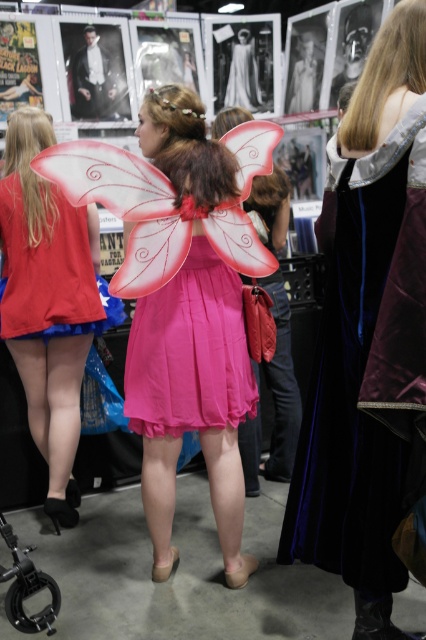
Question: Is pink satin dress at center smaller than matte red dress at center?

Choices:
 (A) no
 (B) yes

Answer: (A)

Question: Which point is closer to the camera?

Choices:
 (A) velvet black dress at center
 (B) matte red dress at center
 (C) pink fabric dress at center

Answer: (A)

Question: Which object is farther from the camera taking this photo?

Choices:
 (A) velvet black dress at center
 (B) black plastic baby carriage at lower left
 (C) pink fabric dress at center
 (D) matte pink fabric dress at center

Answer: (D)

Question: Can you confirm if pink fabric dress at center is smaller than matte pink fabric dress at center?

Choices:
 (A) no
 (B) yes

Answer: (A)

Question: Which of the following is the closest to the observer?

Choices:
 (A) pink satin dress at center
 (B) pink fabric dress at center
 (C) matte red dress at center

Answer: (B)

Question: Is velvet black dress at center above matte pink fabric dress at center?

Choices:
 (A) no
 (B) yes

Answer: (A)